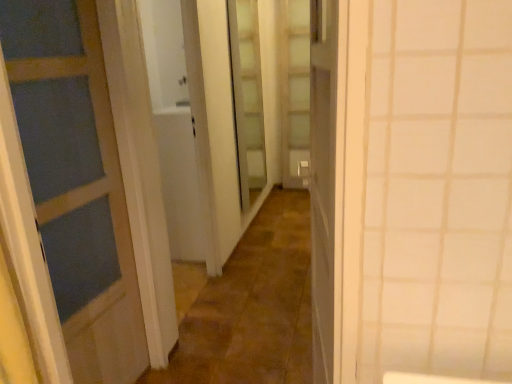
Find the location of a particular element. This screenshot has height=384, width=512. vacant space in clear glass door at center, which is counted as the 2th screen door, starting from the right (from a real-world perspective) is located at coordinates (258, 225).